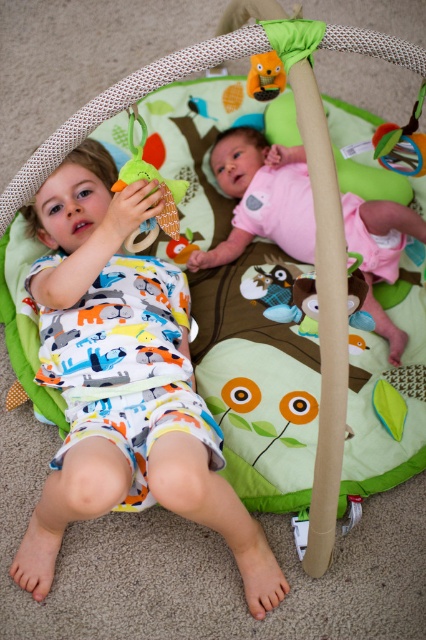
Question: Which of these objects is positioned closest to the white cotton pajamas at left?

Choices:
 (A) matte orange plush toy at center
 (B) soft plush toy at left

Answer: (B)

Question: Which point is farther from the camera taking this photo?

Choices:
 (A) (282, 90)
 (B) (180, 364)
 (C) (406, 141)
 (D) (247, 154)

Answer: (D)

Question: From the image, what is the correct spatial relationship of rubber teething ring at upper right in relation to matte orange plush toy at center?

Choices:
 (A) right
 (B) left

Answer: (A)

Question: Is white cotton pajamas at left positioned in front of matte orange plush toy at upper center?

Choices:
 (A) yes
 (B) no

Answer: (A)

Question: Which of the following is the closest to the observer?

Choices:
 (A) (172, 196)
 (B) (170, 241)
 (C) (267, 52)

Answer: (A)

Question: Is rubber teething ring at upper right above matte orange plush toy at upper center?

Choices:
 (A) yes
 (B) no

Answer: (B)